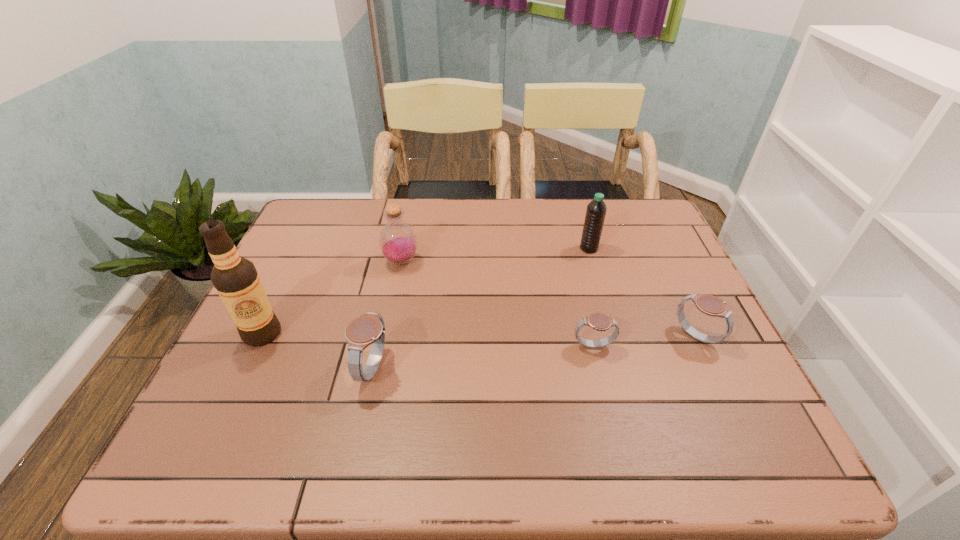
I want to click on vacant space at the near edge of the desktop, so click(x=503, y=417).

Locate an element on the screen. The height and width of the screenshot is (540, 960). free location at the left edge of the desktop is located at coordinates (270, 375).

Where is `free space at the far left corner of the desktop`? This screenshot has width=960, height=540. free space at the far left corner of the desktop is located at coordinates (335, 221).

At what (x,y) coordinates should I click in order to perform the action: click on vacant space at the near right corner. Please return your answer as a coordinate pair (x, y). This screenshot has height=540, width=960. Looking at the image, I should click on (679, 392).

I want to click on empty space between the bottle and the tallest watch, so click(388, 315).

At what (x,y) coordinates should I click in order to perform the action: click on unoccupied position between the water bottle and the bottle. Please return your answer as a coordinate pair (x, y). Looking at the image, I should click on (495, 255).

Where is `vacant space that is in between the fifth tallest object and the alcohol`? Image resolution: width=960 pixels, height=540 pixels. vacant space that is in between the fifth tallest object and the alcohol is located at coordinates (479, 335).

Where is `free space between the bottle and the tallest object`? The height and width of the screenshot is (540, 960). free space between the bottle and the tallest object is located at coordinates (332, 298).

I want to click on vacant area that lies between the water bottle and the leftmost watch, so click(482, 308).

I want to click on vacant space that is in between the bottle and the third shortest object, so click(x=388, y=315).